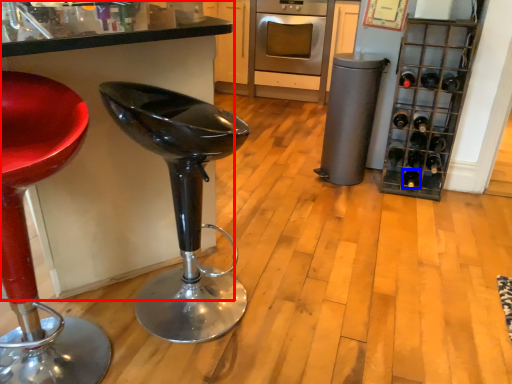
Question: Which of the following is the farthest to the observer, cabinetry (highlighted by a red box) or wine bottle (highlighted by a blue box)?

Choices:
 (A) cabinetry
 (B) wine bottle

Answer: (B)